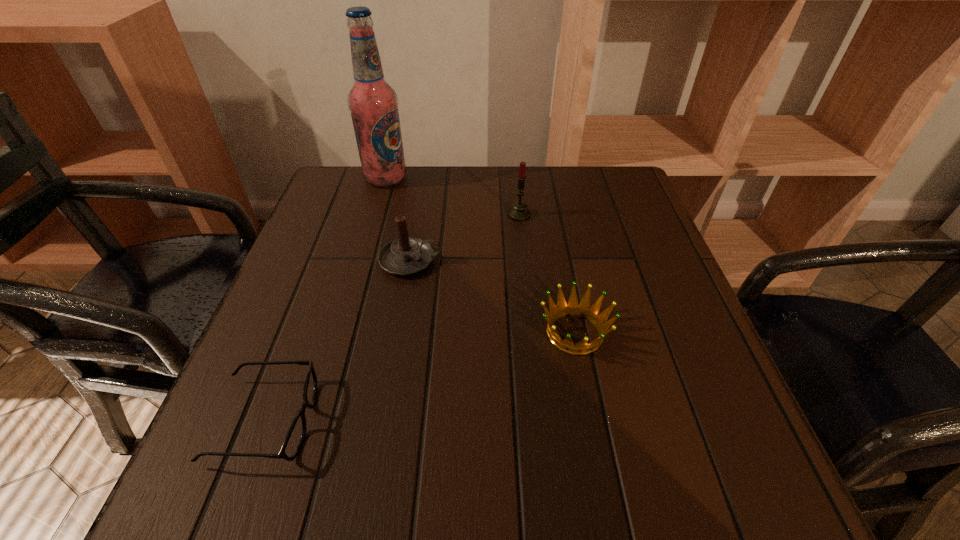
This screenshot has width=960, height=540. I want to click on object that is at the far left corner, so click(x=373, y=103).

The width and height of the screenshot is (960, 540). What are the coordinates of `object positioned at the near left corner` in the screenshot? It's located at coord(294,439).

In the image, there is a desktop. Identify the location of vacant space at the far edge. Image resolution: width=960 pixels, height=540 pixels. (400, 212).

Find the location of `free point at the near edge`. free point at the near edge is located at coordinates (640, 474).

In order to click on vacant space at the left edge in this screenshot , I will do `click(283, 358)`.

Find the location of `vacant region at the right edge of the desktop`. vacant region at the right edge of the desktop is located at coordinates (631, 324).

The image size is (960, 540). I want to click on vacant space at the far right corner of the desktop, so click(x=593, y=168).

Image resolution: width=960 pixels, height=540 pixels. In order to click on vacant region between the right candle and the farthest object in this screenshot , I will do `click(452, 197)`.

Locate an element on the screen. The width and height of the screenshot is (960, 540). unoccupied area between the nearest object and the crown is located at coordinates (420, 376).

Locate an element on the screen. empty space that is in between the third tallest object and the fourth farthest object is located at coordinates (492, 296).